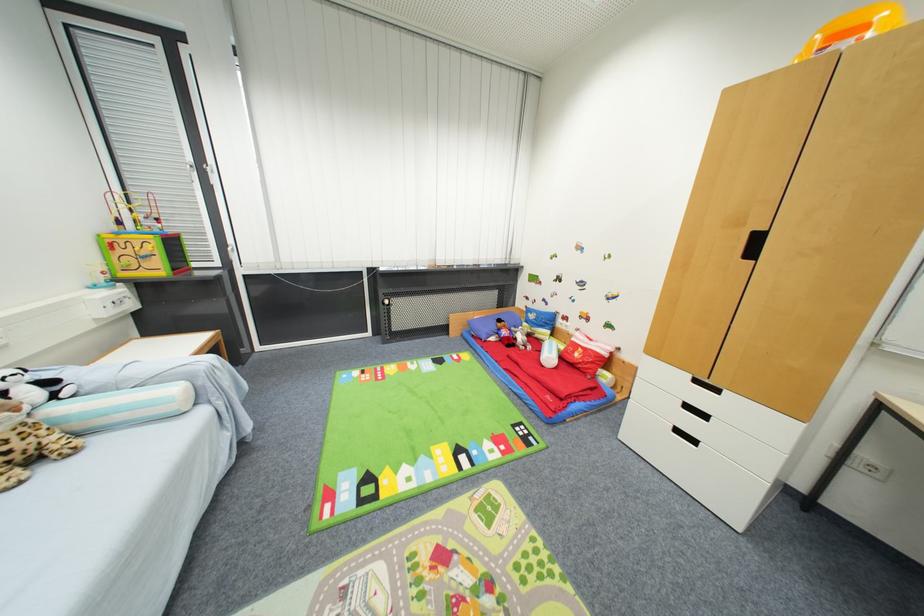
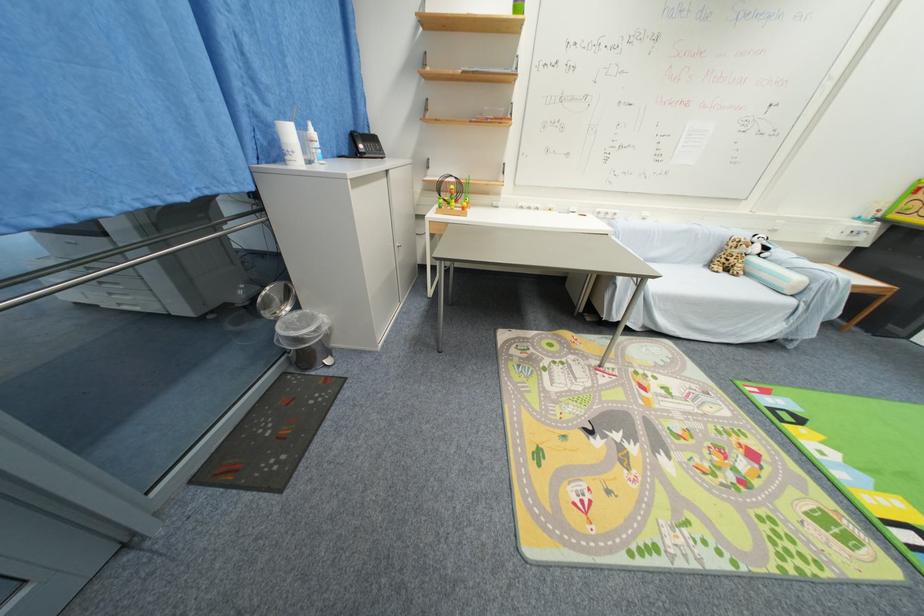
Locate, in the second image, the point that corresponds to [52,471] in the first image.

(730, 276)